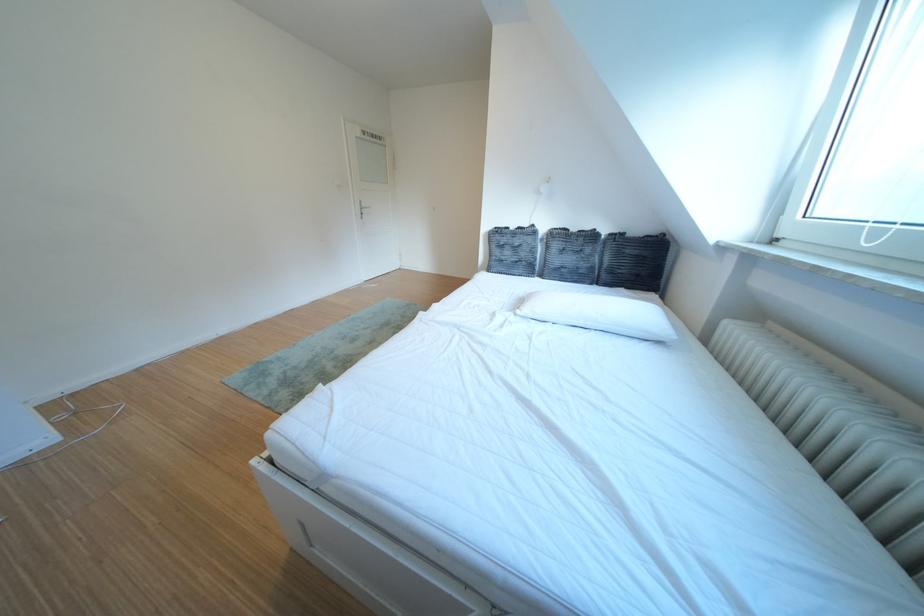
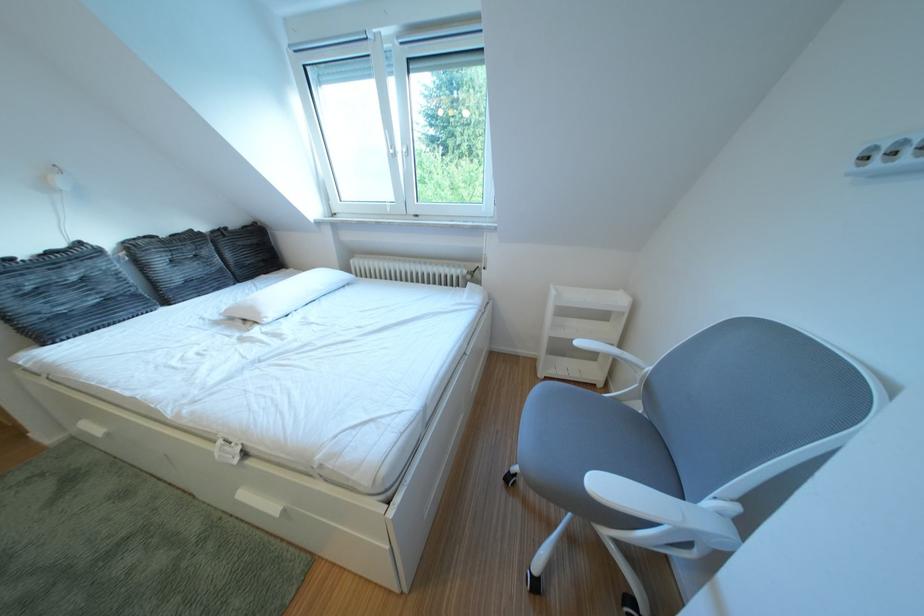
In the second image, find the point that corresponds to point (651, 235) in the first image.

(247, 228)